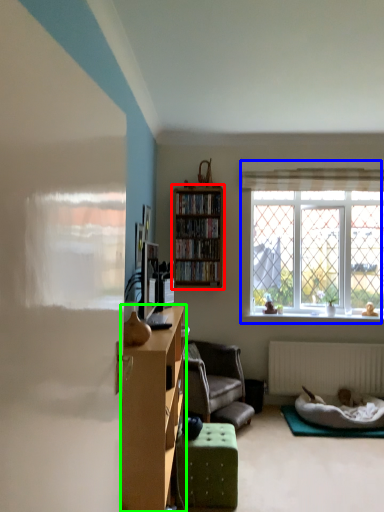
Question: Which object is the farthest from shelf (highlighted by a red box)? Choose among these: window (highlighted by a blue box) or cabinetry (highlighted by a green box).

Choices:
 (A) window
 (B) cabinetry

Answer: (B)